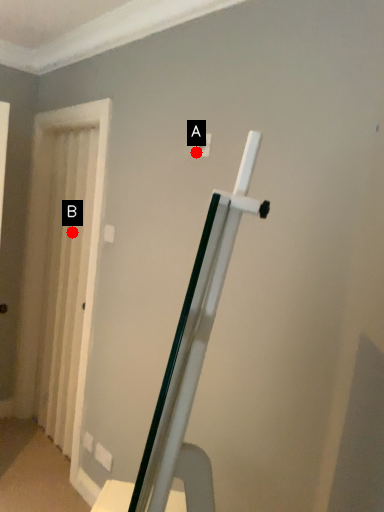
Question: Two points are circled on the image, labeled by A and B beside each circle. Which point is farther to the camera?

Choices:
 (A) A is further
 (B) B is further

Answer: (B)